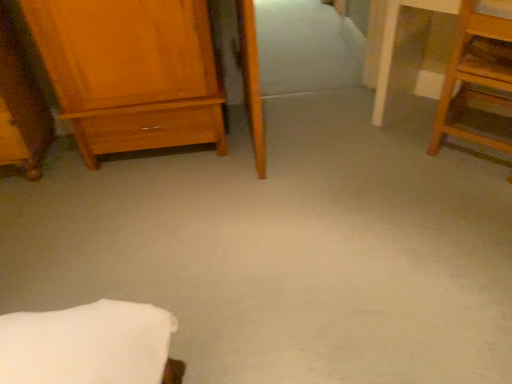
Locate an element on the screen. wooden step stool at right, which is the 2th furniture from left to right is located at coordinates (475, 77).

Is the depth of matte wood chest of drawers at left less than that of wooden step stool at right, acting as the first furniture starting from the right?

That is False.

Can you confirm if matte wood chest of drawers at left is taller than wooden step stool at right, which is the 2th furniture from left to right?

Correct, matte wood chest of drawers at left is much taller as wooden step stool at right, which is the 2th furniture from left to right.

Considering the sizes of matte wood chest of drawers at left and wooden step stool at right, acting as the first furniture starting from the right, in the image, is matte wood chest of drawers at left bigger or smaller than wooden step stool at right, acting as the first furniture starting from the right,?

In the image, matte wood chest of drawers at left appears to be larger than wooden step stool at right, acting as the first furniture starting from the right.

Does wooden wardrobe at left, which ranks as the 1th furniture in left-to-right order, turn towards wooden step stool at right, which is the 2th furniture from left to right?

No.

From a real-world perspective, which is physically above, wooden wardrobe at left, the second furniture viewed from the right, or wooden step stool at right, acting as the first furniture starting from the right?

wooden wardrobe at left, the second furniture viewed from the right.

Is wooden wardrobe at left, the second furniture viewed from the right, spatially inside wooden step stool at right, which is the 2th furniture from left to right, or outside of it?

wooden wardrobe at left, the second furniture viewed from the right, is spatially situated outside wooden step stool at right, which is the 2th furniture from left to right.

Looking at the image, does wooden wardrobe at left, which ranks as the 1th furniture in left-to-right order, seem bigger or smaller compared to wooden step stool at right, which is the 2th furniture from left to right?

Answer: wooden wardrobe at left, which ranks as the 1th furniture in left-to-right order, is bigger than wooden step stool at right, which is the 2th furniture from left to right.

How many degrees apart are the facing directions of matte wood chest of drawers at left and wooden wardrobe at left, which ranks as the 1th furniture in left-to-right order?

matte wood chest of drawers at left and wooden wardrobe at left, which ranks as the 1th furniture in left-to-right order, are facing 0.262 degrees away from each other.

Who is more distant, matte wood chest of drawers at left or wooden wardrobe at left, which ranks as the 1th furniture in left-to-right order?

Positioned behind is matte wood chest of drawers at left.

Which of these two, matte wood chest of drawers at left or wooden wardrobe at left, which ranks as the 1th furniture in left-to-right order, is wider?

Wider between the two is matte wood chest of drawers at left.

Could you measure the distance between matte wood chest of drawers at left and wooden wardrobe at left, the second furniture viewed from the right?

matte wood chest of drawers at left is 21.37 inches from wooden wardrobe at left, the second furniture viewed from the right.

From the image's perspective, which object appears higher, wooden wardrobe at left, the second furniture viewed from the right, or matte wood chest of drawers at left?

From the image's view, matte wood chest of drawers at left is above.

Could matte wood chest of drawers at left be considered to be inside wooden wardrobe at left, the second furniture viewed from the right?

Definitely not — matte wood chest of drawers at left is not inside wooden wardrobe at left, the second furniture viewed from the right.

Does wooden wardrobe at left, the second furniture viewed from the right, touch matte wood chest of drawers at left?

wooden wardrobe at left, the second furniture viewed from the right, and matte wood chest of drawers at left are not in contact.

Between wooden step stool at right, acting as the first furniture starting from the right, and matte wood chest of drawers at left, which one has less height?

Standing shorter between the two is wooden step stool at right, acting as the first furniture starting from the right.

Is wooden step stool at right, acting as the first furniture starting from the right, bigger than matte wood chest of drawers at left?

No.

Is wooden step stool at right, which is the 2th furniture from left to right, touching matte wood chest of drawers at left?

wooden step stool at right, which is the 2th furniture from left to right, and matte wood chest of drawers at left are not in contact.

Which object is more forward, wooden step stool at right, which is the 2th furniture from left to right, or matte wood chest of drawers at left?

Positioned in front is wooden step stool at right, which is the 2th furniture from left to right.

Considering the sizes of objects wooden step stool at right, which is the 2th furniture from left to right, and wooden wardrobe at left, the second furniture viewed from the right, in the image provided, who is smaller, wooden step stool at right, which is the 2th furniture from left to right, or wooden wardrobe at left, the second furniture viewed from the right,?

wooden step stool at right, which is the 2th furniture from left to right.

Locate an element on the screen. This screenshot has height=384, width=512. furniture that is in front of the wooden wardrobe at left, which ranks as the 1th furniture in left-to-right order is located at coordinates (475, 77).

Does wooden step stool at right, which is the 2th furniture from left to right, turn towards wooden wardrobe at left, which ranks as the 1th furniture in left-to-right order?

No, wooden step stool at right, which is the 2th furniture from left to right, is not aimed at wooden wardrobe at left, which ranks as the 1th furniture in left-to-right order.

Does wooden step stool at right, which is the 2th furniture from left to right, have a lesser width compared to wooden wardrobe at left, which ranks as the 1th furniture in left-to-right order?

Correct, the width of wooden step stool at right, which is the 2th furniture from left to right, is less than that of wooden wardrobe at left, which ranks as the 1th furniture in left-to-right order.

Locate an element on the screen. the chest of drawers located above the wooden step stool at right, acting as the first furniture starting from the right (from the image's perspective) is located at coordinates 131,72.

Where is `furniture that is in front of the wooden wardrobe at left, which ranks as the 1th furniture in left-to-right order`? This screenshot has height=384, width=512. furniture that is in front of the wooden wardrobe at left, which ranks as the 1th furniture in left-to-right order is located at coordinates (475, 77).

Looking at the image, which one is located closer to wooden wardrobe at left, which ranks as the 1th furniture in left-to-right order, wooden step stool at right, acting as the first furniture starting from the right, or matte wood chest of drawers at left?

Among the two, matte wood chest of drawers at left is located nearer to wooden wardrobe at left, which ranks as the 1th furniture in left-to-right order.

When comparing their distances from matte wood chest of drawers at left, does wooden step stool at right, which is the 2th furniture from left to right, or wooden wardrobe at left, the second furniture viewed from the right, seem further?

wooden step stool at right, which is the 2th furniture from left to right, is positioned further to the anchor matte wood chest of drawers at left.

Which object lies further to the anchor point wooden wardrobe at left, which ranks as the 1th furniture in left-to-right order, matte wood chest of drawers at left or wooden step stool at right, acting as the first furniture starting from the right?

wooden step stool at right, acting as the first furniture starting from the right, is further to wooden wardrobe at left, which ranks as the 1th furniture in left-to-right order.

From the picture: Which object lies nearer to the anchor point wooden step stool at right, acting as the first furniture starting from the right, matte wood chest of drawers at left or wooden wardrobe at left, the second furniture viewed from the right?

matte wood chest of drawers at left is closer to wooden step stool at right, acting as the first furniture starting from the right.

When comparing their distances from matte wood chest of drawers at left, does wooden wardrobe at left, the second furniture viewed from the right, or wooden step stool at right, acting as the first furniture starting from the right, seem further?

The object further to matte wood chest of drawers at left is wooden step stool at right, acting as the first furniture starting from the right.

From the image, which object appears to be farther from wooden step stool at right, which is the 2th furniture from left to right, wooden wardrobe at left, the second furniture viewed from the right, or matte wood chest of drawers at left?

The object further to wooden step stool at right, which is the 2th furniture from left to right, is wooden wardrobe at left, the second furniture viewed from the right.

Locate an element on the screen. The image size is (512, 384). the chest of drawers situated between wooden wardrobe at left, the second furniture viewed from the right, and wooden step stool at right, acting as the first furniture starting from the right, from left to right is located at coordinates (131, 72).